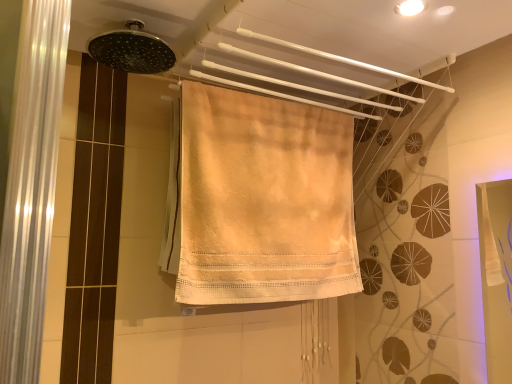
The height and width of the screenshot is (384, 512). Find the location of `free space above beige cotton towel at center (from a real-world perspective)`. free space above beige cotton towel at center (from a real-world perspective) is located at coordinates (275, 99).